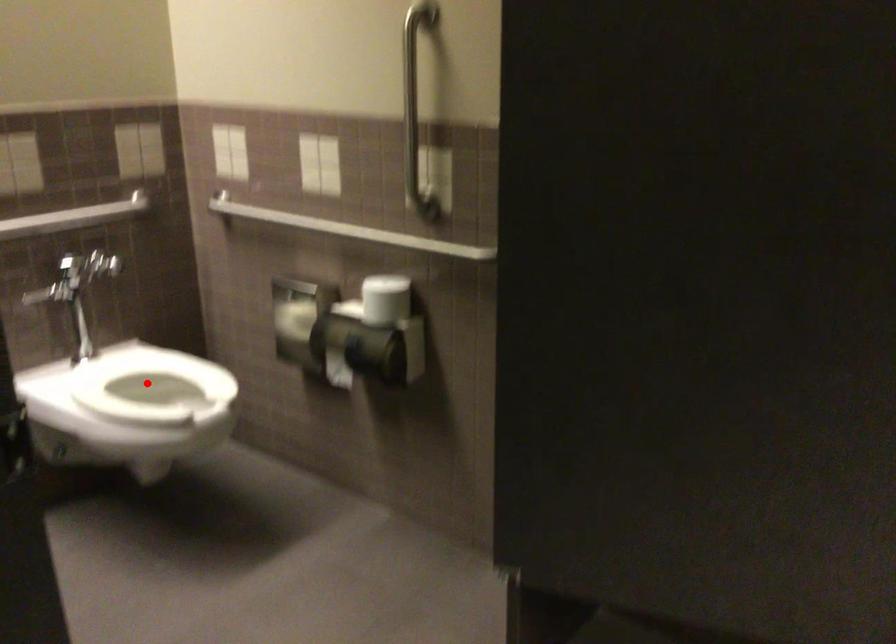
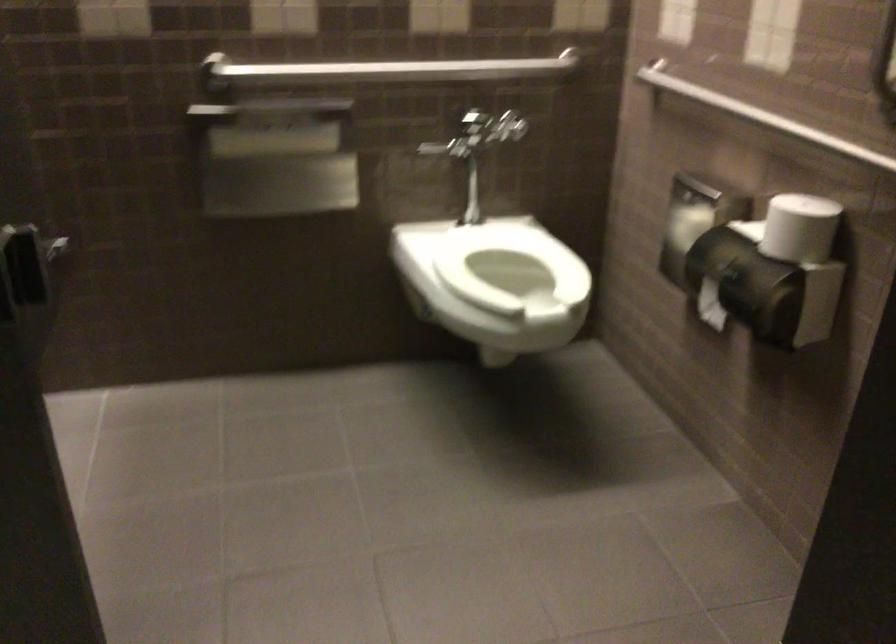
Locate, in the second image, the point that corresponds to the highlighted location in the first image.

(509, 263)